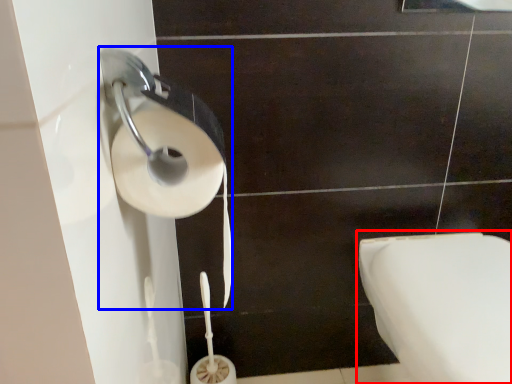
Question: Which object is further to the camera taking this photo, toilet (highlighted by a red box) or toilet paper (highlighted by a blue box)?

Choices:
 (A) toilet
 (B) toilet paper

Answer: (A)